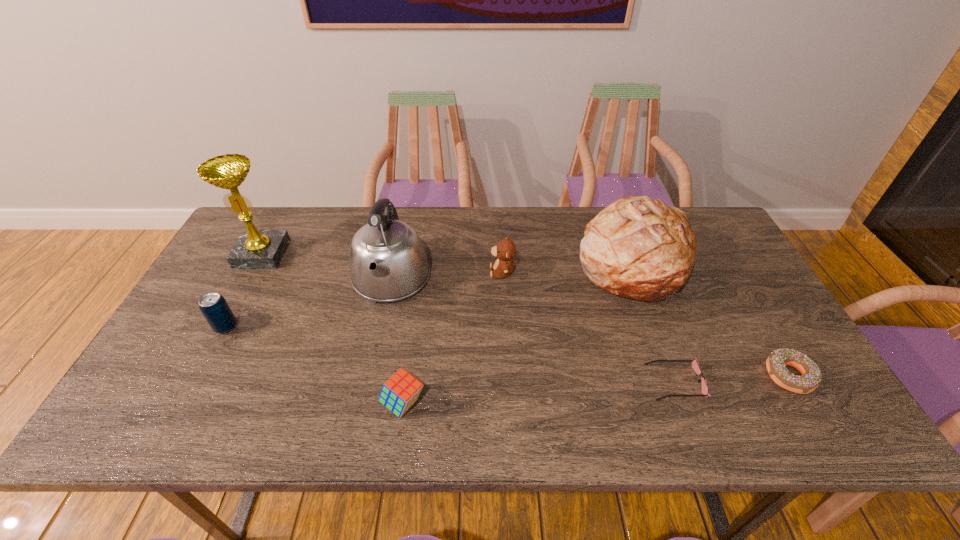
Locate an element on the screen. Image resolution: width=960 pixels, height=540 pixels. vacant area in the image that satisfies the following two spatial constraints: 1. on the front side of the fourth nearest object; 2. on the right side of the sixth tallest object is located at coordinates click(x=185, y=403).

Image resolution: width=960 pixels, height=540 pixels. I want to click on vacant area in the image that satisfies the following two spatial constraints: 1. on the spout of the cube; 2. on the left side of the seventh shortest object, so click(365, 403).

Locate an element on the screen. Image resolution: width=960 pixels, height=540 pixels. vacant space that satisfies the following two spatial constraints: 1. on the spout of the kettle; 2. on the right side of the second shortest object is located at coordinates (371, 376).